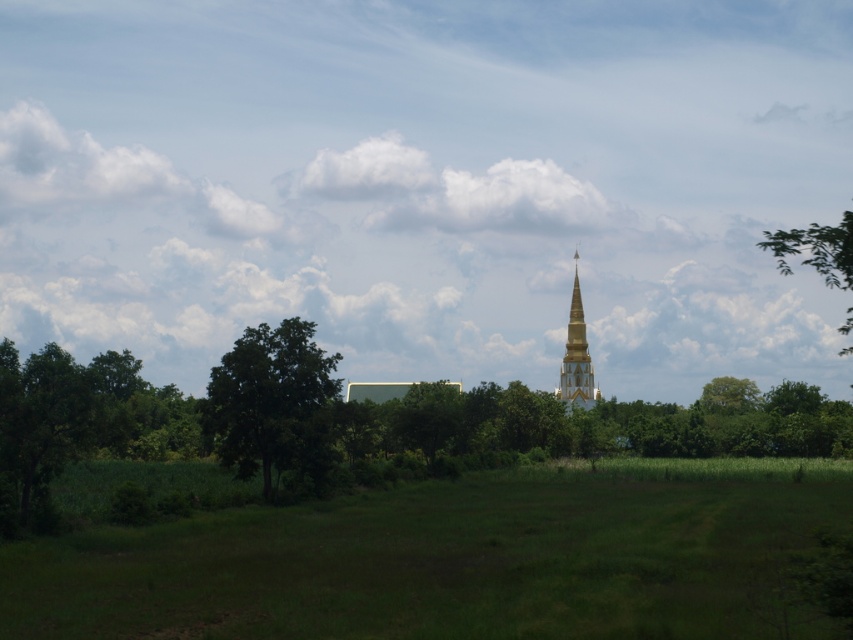
Question: Which object is positioned closest to the green grassy field at lower center?

Choices:
 (A) green leafy tree at left
 (B) green leafy tree at upper right
 (C) gold metallic stupa at center

Answer: (A)

Question: Does green grassy field at lower center have a greater width compared to gold metallic stupa at center?

Choices:
 (A) yes
 (B) no

Answer: (A)

Question: Estimate the real-world distances between objects in this image. Which object is closer to the green leafy tree at upper right?

Choices:
 (A) green grassy field at lower center
 (B) green leafy tree at left

Answer: (A)

Question: Estimate the real-world distances between objects in this image. Which object is closer to the green grassy field at lower center?

Choices:
 (A) green leafy tree at left
 (B) green leafy tree at upper right

Answer: (A)

Question: Where is green leafy tree at left located in relation to gold metallic stupa at center in the image?

Choices:
 (A) right
 (B) left

Answer: (B)

Question: Can you confirm if green grassy field at lower center is positioned to the right of green leafy tree at left?

Choices:
 (A) yes
 (B) no

Answer: (A)